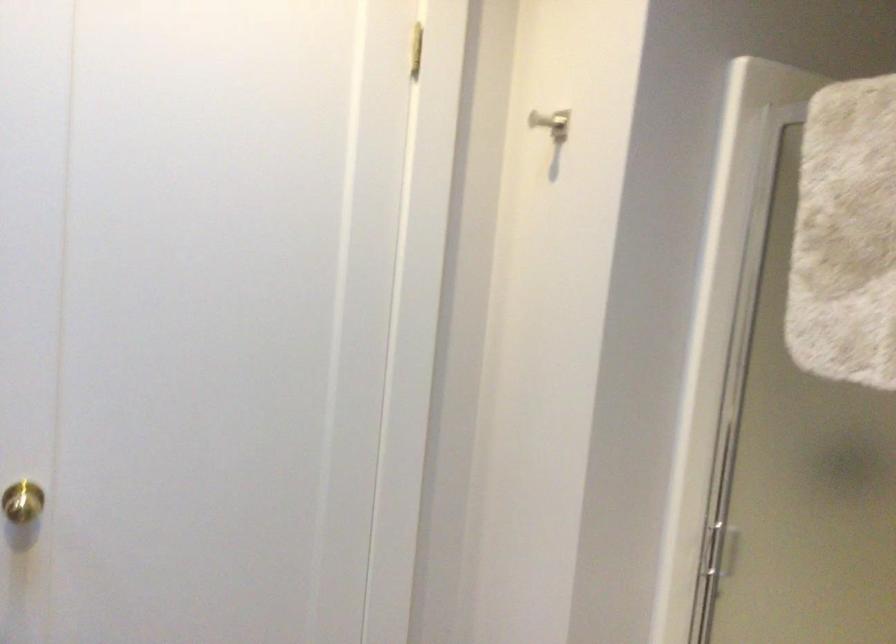
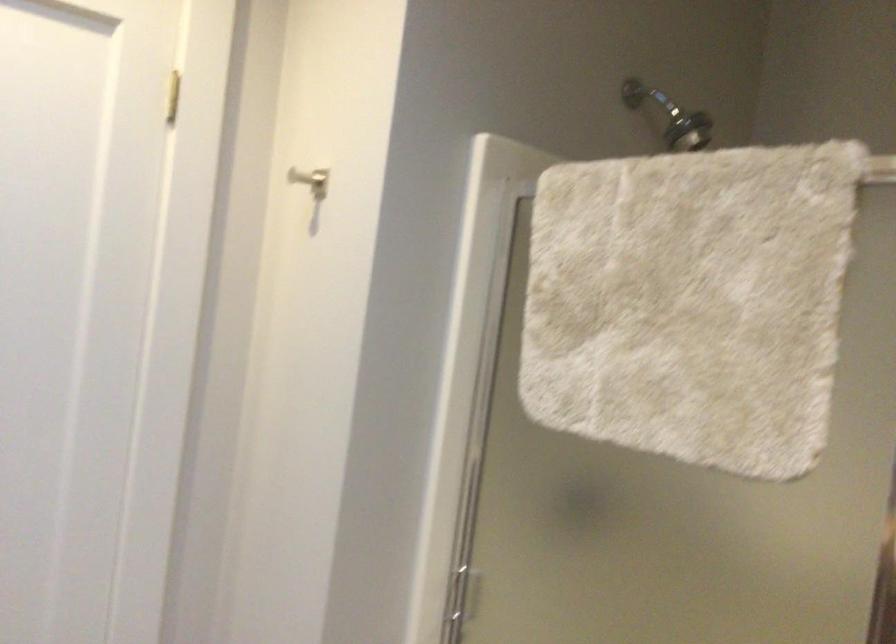
The images are taken continuously from a first-person perspective. In which direction are you moving?

The cameraman walked toward right, backward.